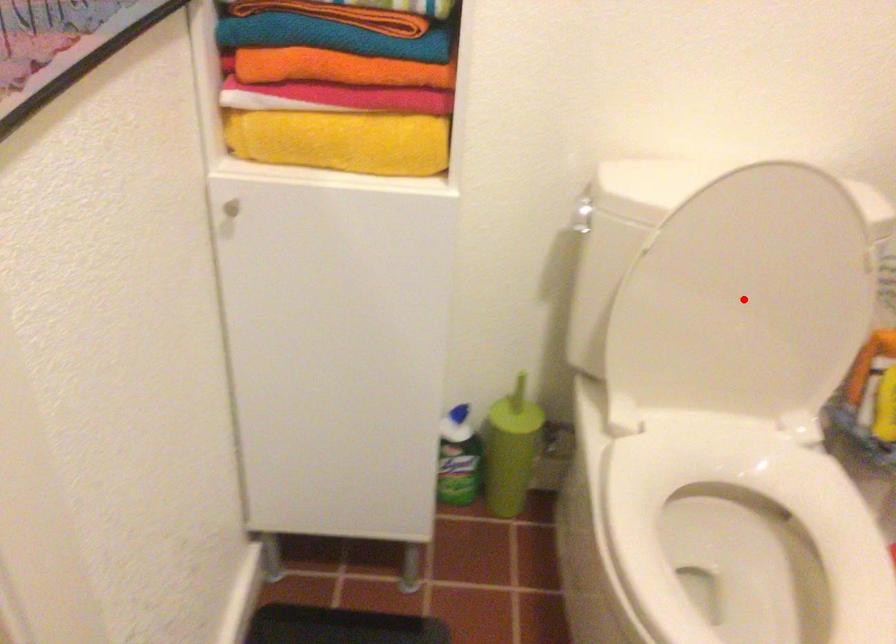
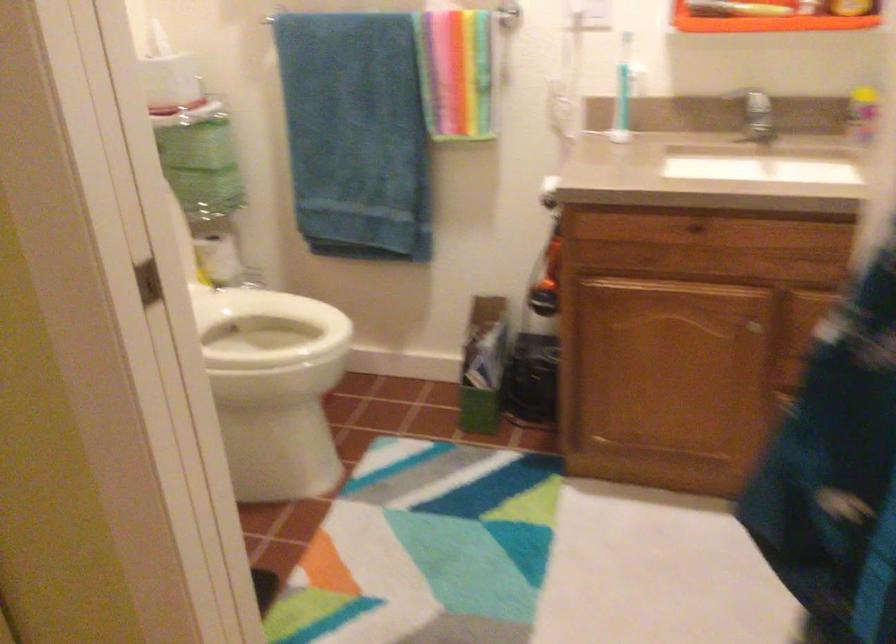
Question: I am providing you with two images of the same scene from different viewpoints. A red point is marked on the first image. At the location where the point appears in image 1, is it still visible in image 2?

Choices:
 (A) Yes
 (B) No

Answer: (B)